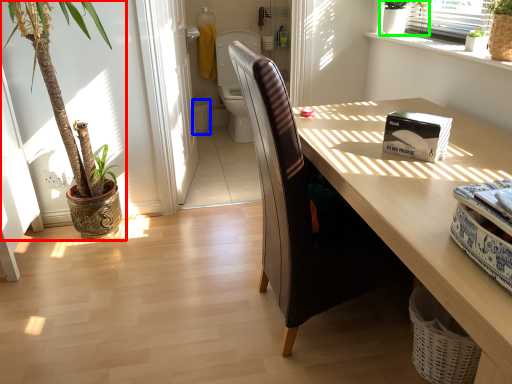
Question: Estimate the real-world distances between objects in this image. Which object is closer to houseplant (highlighted by a red box), basket (highlighted by a blue box) or houseplant (highlighted by a green box)?

Choices:
 (A) basket
 (B) houseplant

Answer: (B)